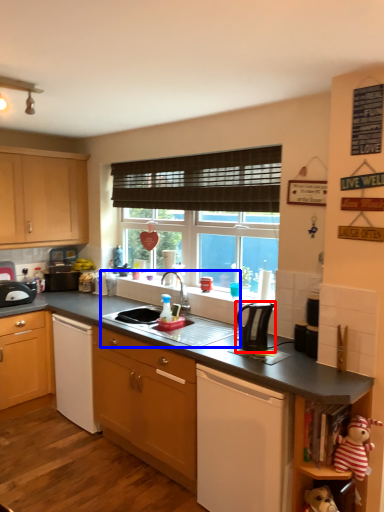
Question: Which object appears farthest to the camera in this image, kitchen appliance (highlighted by a red box) or sink (highlighted by a blue box)?

Choices:
 (A) kitchen appliance
 (B) sink

Answer: (B)